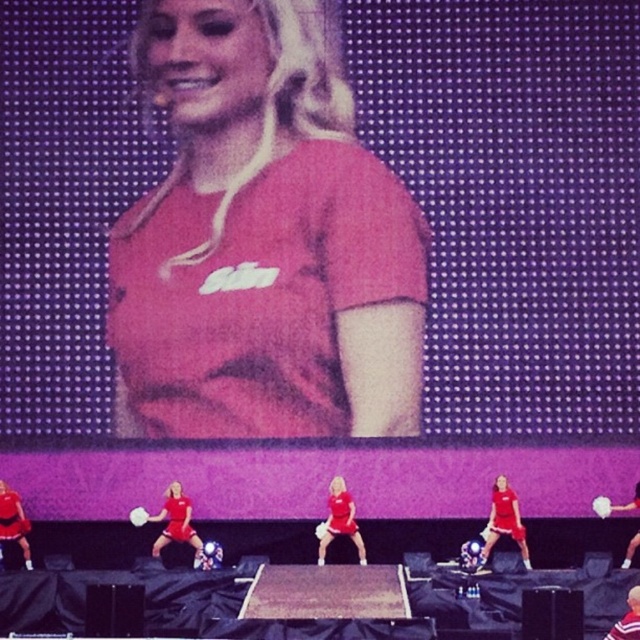
You are a photographer standing at the camera position. You want to capture a closeup shot of the matte red shorts at lower right. Given that the camera has a maximum zoom range of 60 meters, will you be able to achieve this without moving closer?

The matte red shorts at lower right and camera are 70.85 meters apart from each other. Since the camera can only zoom up to 60 meters, you won question the ability to capture a clear closeup without moving closer.

In the scene shown: You are a stagehand preparing to place a new prop on the stage. You need to position it between the two matte red shorts at lower right and matte red shorts at lower left. Based on their positions, which direction should you place the prop relative to the lower right shorts?

The matte red shorts at lower right is located below the matte red shorts at lower left. Therefore, to place the prop between them, you should position it above the matte red shorts at lower right.

You are a photographer standing at the back of the stage. You want to take a photo that includes both the point at coordinates point (353, 513) and point (26, 531). Which point will appear larger in your photo?

Point (353, 513) will appear larger in the photo because it is closer to the camera than point (26, 531).